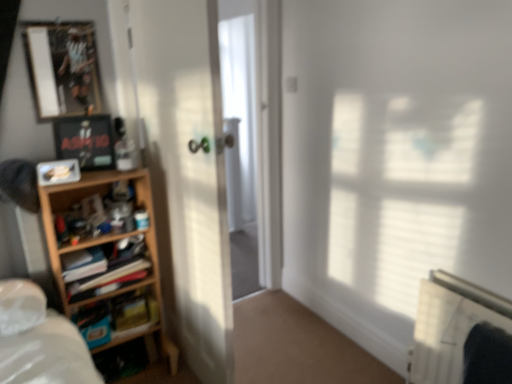
Question: Considering the positions of wooden shelf at left, which appears as the 2th shelf when ordered from the bottom, and white plastic radiator at lower right in the image, is wooden shelf at left, which appears as the 2th shelf when ordered from the bottom, bigger or smaller than white plastic radiator at lower right?

Choices:
 (A) small
 (B) big

Answer: (A)

Question: Does point (129, 254) appear closer or farther from the camera than point (498, 309)?

Choices:
 (A) farther
 (B) closer

Answer: (A)

Question: Considering the real-world distances, which object is closest to the matte plastic picture frame at left, the 1th picture frame positioned from the bottom?

Choices:
 (A) wooden shelf at left, marked as the first shelf in a bottom-to-top arrangement
 (B) white glossy screen door at center
 (C) white plastic radiator at lower right
 (D) metallic silver picture frame at upper left, the first picture frame viewed from the top
 (E) wooden shelf at left, which appears as the 2th shelf when ordered from the bottom

Answer: (A)

Question: Considering the real-world distances, which object is farthest from the matte plastic picture frame at left, which ranks as the third picture frame in top-to-bottom order?

Choices:
 (A) wooden shelf at left, the first shelf when ordered from top to bottom
 (B) metallic silver picture frame at upper left, the first picture frame viewed from the top
 (C) matte black picture frame at upper left, the second picture frame positioned from the bottom
 (D) white glossy screen door at center
 (E) wooden shelf at left, which is counted as the 2th shelf, starting from the top

Answer: (D)